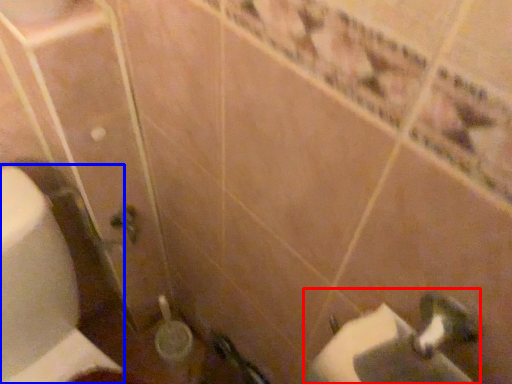
Question: Which object is closer to the camera taking this photo, sink (highlighted by a red box) or toilet paper (highlighted by a blue box)?

Choices:
 (A) sink
 (B) toilet paper

Answer: (A)